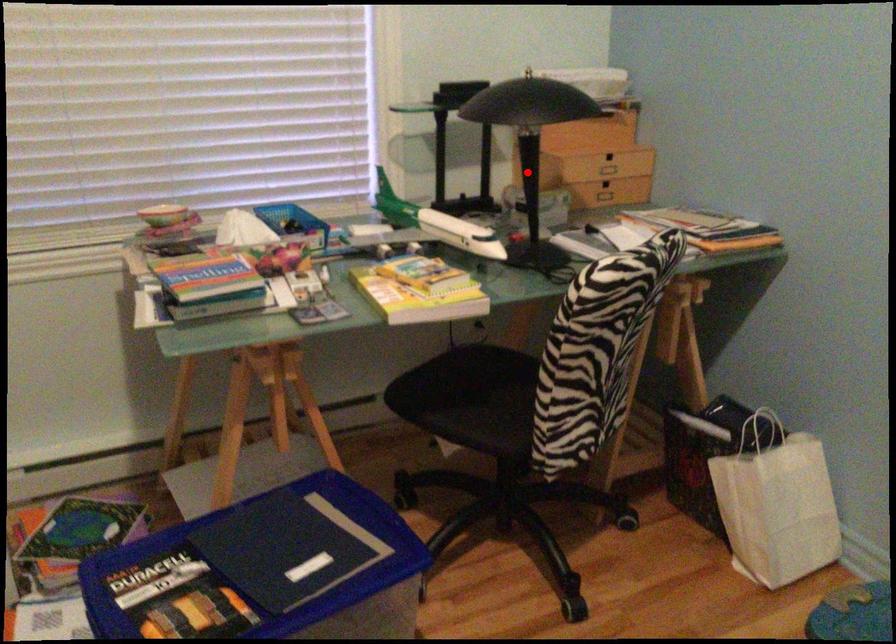
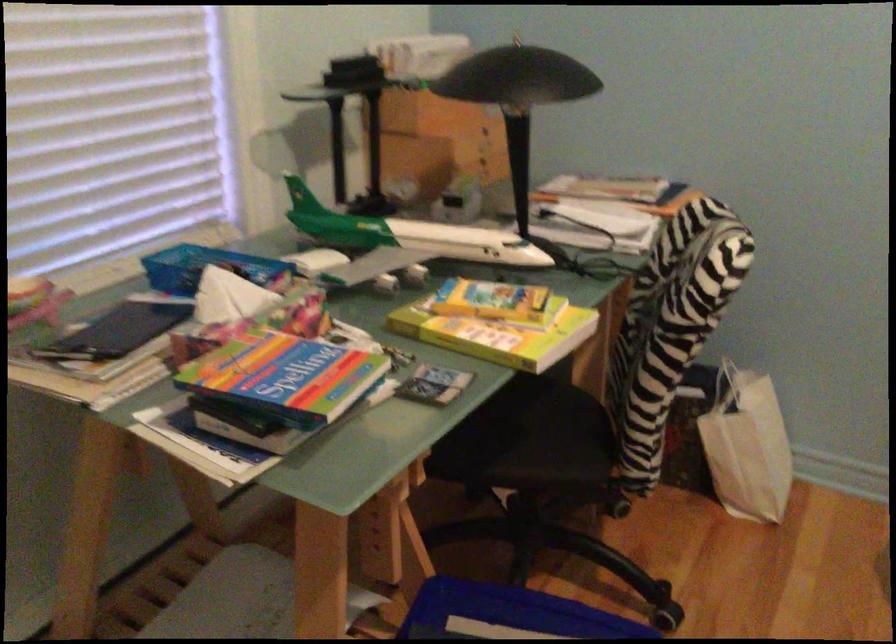
Locate, in the second image, the point that corresponds to the highlighted location in the first image.

(519, 158)